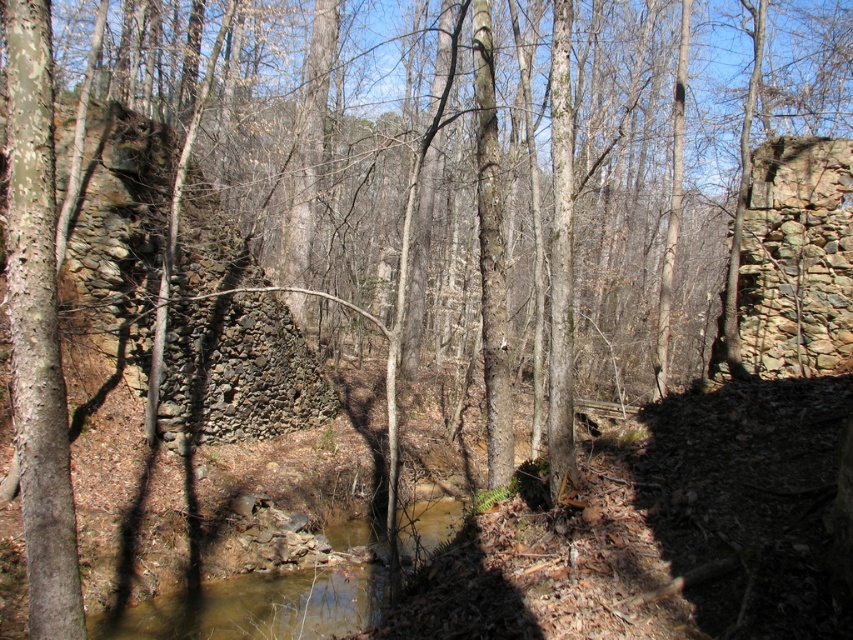
Looking at this image, can you confirm if dark gray stone wall at left is positioned below rusty stone wall at right?

No, dark gray stone wall at left is not below rusty stone wall at right.

Consider the image. Does dark gray stone wall at left have a larger size compared to rusty stone wall at right?

No.

What do you see at coordinates (230, 339) in the screenshot? I see `dark gray stone wall at left` at bounding box center [230, 339].

What are the coordinates of `dark gray stone wall at left` in the screenshot? It's located at (230, 339).

The image size is (853, 640). Describe the element at coordinates (230, 339) in the screenshot. I see `dark gray stone wall at left` at that location.

Does dark gray stone wall at left come in front of brown muddy water at center?

No, dark gray stone wall at left is behind brown muddy water at center.

The width and height of the screenshot is (853, 640). In order to click on dark gray stone wall at left in this screenshot , I will do `click(230, 339)`.

Is rusty stone wall at right further to the viewer compared to brown muddy water at center?

That is True.

Measure the distance between rusty stone wall at right and camera.

rusty stone wall at right and camera are 8.57 meters apart.

At what (x,y) coordinates should I click in order to perform the action: click on rusty stone wall at right. Please return your answer as a coordinate pair (x, y). Looking at the image, I should click on (796, 257).

Locate an element on the screen. The image size is (853, 640). rusty stone wall at right is located at coordinates (796, 257).